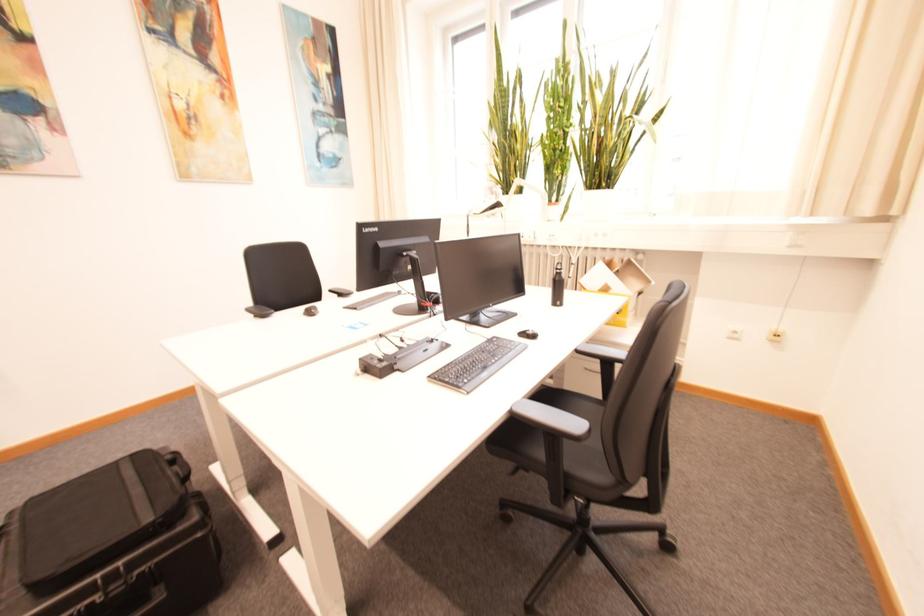
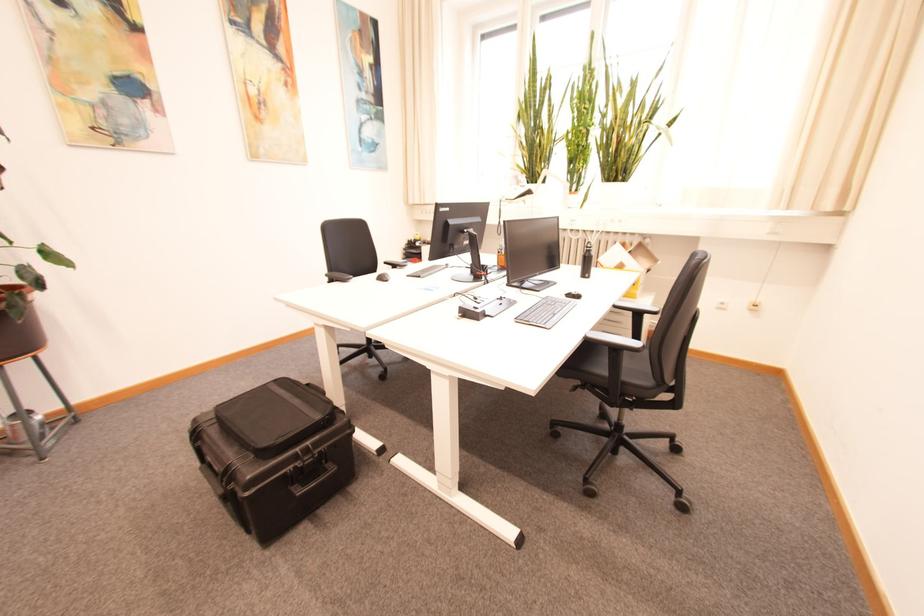
Find the pixel in the second image that matches point 544,339 in the first image.

(589, 299)